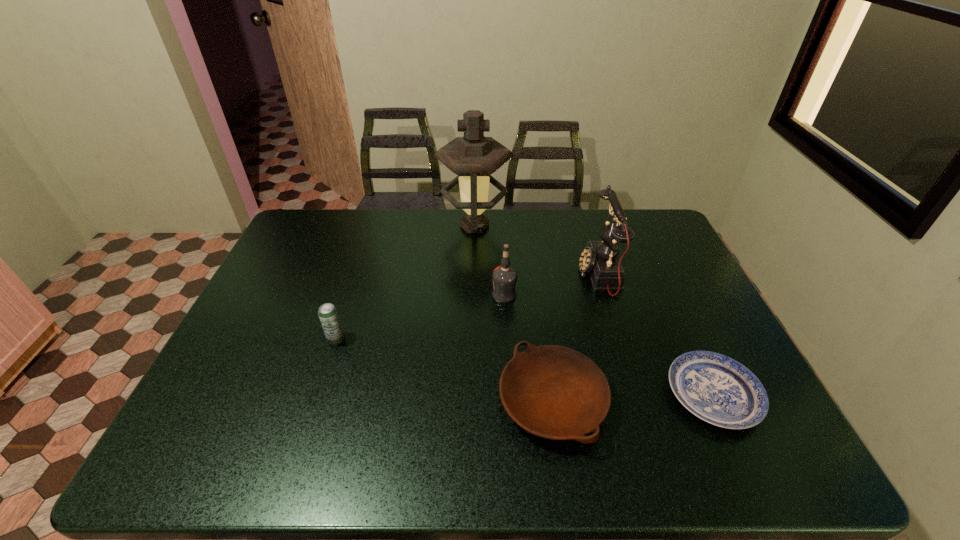
Locate an element on the screen. free space between the left plate and the tallest object is located at coordinates (514, 313).

Where is `object that is the fifth closest to the farthest object`? Image resolution: width=960 pixels, height=540 pixels. object that is the fifth closest to the farthest object is located at coordinates (719, 390).

Where is `object that can be found as the fifth closest to the third shortest object`? This screenshot has width=960, height=540. object that can be found as the fifth closest to the third shortest object is located at coordinates (719, 390).

Locate an element on the screen. free space that satisfies the following two spatial constraints: 1. on the back side of the taller plate; 2. on the left side of the shortest object is located at coordinates (551, 395).

Find the location of `free space that satisfies the following two spatial constraints: 1. on the front label of the fourth shortest object; 2. on the left side of the second shortest object`. free space that satisfies the following two spatial constraints: 1. on the front label of the fourth shortest object; 2. on the left side of the second shortest object is located at coordinates (511, 401).

This screenshot has height=540, width=960. I want to click on vacant space that satisfies the following two spatial constraints: 1. on the dial of the fifth shortest object; 2. on the right side of the right plate, so click(x=636, y=395).

Find the location of a particular element. free space in the image that satisfies the following two spatial constraints: 1. on the front label of the shortest object; 2. on the right side of the vodka is located at coordinates (510, 395).